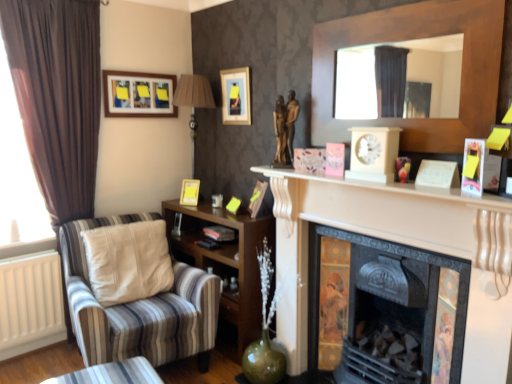
Describe the element at coordinates (139, 308) in the screenshot. I see `striped fabric armchair at left` at that location.

Measure the distance between metallic ornate fireplace at center, which is counted as the 2th fireplace, starting from the left, and camera.

metallic ornate fireplace at center, which is counted as the 2th fireplace, starting from the left, and camera are 1.64 meters apart from each other.

This screenshot has height=384, width=512. Identify the location of metallic silver lamp at upper center. (193, 101).

Describe the element at coordinates (401, 243) in the screenshot. Image resolution: width=512 pixels, height=384 pixels. I see `white glossy fireplace at center, placed as the first fireplace when sorted from left to right` at that location.

In order to face white glossy fireplace at center, placed as the second fireplace when sorted from right to left, should I rotate leftwards or rightwards?

It's best to rotate right around 14.042 degrees.

In order to face matte gold picture frame at center, which ranks as the 3th picture frame in top-to-bottom order, should I rotate leftwards or rightwards?

It's best to rotate left around 8.683 degrees.

Find the location of a particular element. The height and width of the screenshot is (384, 512). brown fabric curtain at left is located at coordinates (57, 96).

Consider the image. From the image's perspective, is bronze statue at center below brown fabric curtain at left?

No.

Is bronze statue at center closer to the viewer compared to brown fabric curtain at left?

Yes, bronze statue at center is closer to the viewer.

Locate an element on the screen. curtain lying below the bronze statue at center (from the image's perspective) is located at coordinates (57, 96).

Is point (296, 107) positioned before point (42, 126)?

Yes, it is.

Is matte gold picture frame at center, positioned as the 1th picture frame in bottom-to-top order, looking in the opposite direction of matte wooden picture frame at upper left, which ranks as the 3th picture frame in right-to-left order?

No, matte gold picture frame at center, positioned as the 1th picture frame in bottom-to-top order,'s orientation is not away from matte wooden picture frame at upper left, which ranks as the 3th picture frame in right-to-left order.

From the image's perspective, which one is positioned lower, matte gold picture frame at center, which ranks as the 3th picture frame in top-to-bottom order, or matte wooden picture frame at upper left, the 1th picture frame when ordered from top to bottom?

matte gold picture frame at center, which ranks as the 3th picture frame in top-to-bottom order, appears lower in the image.

How much distance is there between matte gold picture frame at center, arranged as the 2th picture frame when viewed from the right, and matte wooden picture frame at upper left, the 1th picture frame when ordered from top to bottom?

matte gold picture frame at center, arranged as the 2th picture frame when viewed from the right, is 27.25 inches from matte wooden picture frame at upper left, the 1th picture frame when ordered from top to bottom.

Identify the location of the 1st picture frame in front of the matte gold picture frame at center, arranged as the 2th picture frame when viewed from the right, counting from the anchor's position. (138, 94).

Is metallic ornate fireplace at center, which is counted as the 2th fireplace, starting from the left, not near metallic silver lamp at upper center?

metallic ornate fireplace at center, which is counted as the 2th fireplace, starting from the left, is positioned a significant distance from metallic silver lamp at upper center.

Which is more to the left, metallic ornate fireplace at center, the 1th fireplace viewed from the right, or metallic silver lamp at upper center?

metallic silver lamp at upper center is more to the left.

From a real-world perspective, does metallic ornate fireplace at center, the 1th fireplace viewed from the right, stand above metallic silver lamp at upper center?

No, from a real-world perspective, metallic ornate fireplace at center, the 1th fireplace viewed from the right, is not above metallic silver lamp at upper center.

Looking at this image, is the position of striped fabric armchair at left more distant than that of bronze statue at center?

No, striped fabric armchair at left is closer to the camera.

Find the location of a particular element. The width and height of the screenshot is (512, 384). sculpture above the striped fabric armchair at left (from the image's perspective) is located at coordinates (285, 127).

Can you confirm if striped fabric armchair at left is wider than bronze statue at center?

Yes, striped fabric armchair at left is wider than bronze statue at center.

How many degrees apart are the facing directions of striped fabric armchair at left and bronze statue at center?

There is a 45.2-degree angle between the facing directions of striped fabric armchair at left and bronze statue at center.

Which is behind, matte gold picture frame at center, positioned as the 1th picture frame in bottom-to-top order, or metallic ornate fireplace at center, which is counted as the 2th fireplace, starting from the left?

Positioned behind is matte gold picture frame at center, positioned as the 1th picture frame in bottom-to-top order.

Can you confirm if matte gold picture frame at center, the second picture frame viewed from the left, is positioned to the right of metallic ornate fireplace at center, the 1th fireplace viewed from the right?

In fact, matte gold picture frame at center, the second picture frame viewed from the left, is to the left of metallic ornate fireplace at center, the 1th fireplace viewed from the right.

From the image's perspective, is matte gold picture frame at center, the second picture frame viewed from the left, located above or below metallic ornate fireplace at center, which is counted as the 2th fireplace, starting from the left?

Clearly, from the image's perspective, matte gold picture frame at center, the second picture frame viewed from the left, is above metallic ornate fireplace at center, which is counted as the 2th fireplace, starting from the left.

Is matte gold picture frame at center, positioned as the 1th picture frame in bottom-to-top order, thinner than metallic ornate fireplace at center, which is counted as the 2th fireplace, starting from the left?

Yes.

Is matte gold picture frame at upper center, which is the 3th picture frame in left-to-right order, facing away from metallic ornate fireplace at center, the 1th fireplace viewed from the right?

matte gold picture frame at upper center, which is the 3th picture frame in left-to-right order, is not turned away from metallic ornate fireplace at center, the 1th fireplace viewed from the right.

Identify the location of picture frame that is the 1st object located behind the metallic ornate fireplace at center, which is counted as the 2th fireplace, starting from the left. The width and height of the screenshot is (512, 384). (236, 96).

From the image's perspective, is matte gold picture frame at upper center, which appears as the first picture frame when viewed from the right, above or below metallic ornate fireplace at center, which is counted as the 2th fireplace, starting from the left?

matte gold picture frame at upper center, which appears as the first picture frame when viewed from the right, is situated higher than metallic ornate fireplace at center, which is counted as the 2th fireplace, starting from the left, in the image.

What's the angular difference between matte gold picture frame at upper center, which is the 3th picture frame in left-to-right order, and metallic ornate fireplace at center, the 1th fireplace viewed from the right,'s facing directions?

The facing directions of matte gold picture frame at upper center, which is the 3th picture frame in left-to-right order, and metallic ornate fireplace at center, the 1th fireplace viewed from the right, are 2.95 degrees apart.

Is metallic ornate fireplace at center, which is counted as the 2th fireplace, starting from the left, looking in the opposite direction of wooden shelf at lower left?

No, metallic ornate fireplace at center, which is counted as the 2th fireplace, starting from the left,'s orientation is not away from wooden shelf at lower left.

Is metallic ornate fireplace at center, which is counted as the 2th fireplace, starting from the left, taller or shorter than wooden shelf at lower left?

Clearly, metallic ornate fireplace at center, which is counted as the 2th fireplace, starting from the left, is taller compared to wooden shelf at lower left.

How different are the orientations of metallic ornate fireplace at center, the 1th fireplace viewed from the right, and wooden shelf at lower left in degrees?

The facing directions of metallic ornate fireplace at center, the 1th fireplace viewed from the right, and wooden shelf at lower left are 3.26 degrees apart.

How much distance is there between metallic ornate fireplace at center, which is counted as the 2th fireplace, starting from the left, and wooden shelf at lower left?

A distance of 26.44 inches exists between metallic ornate fireplace at center, which is counted as the 2th fireplace, starting from the left, and wooden shelf at lower left.

Image resolution: width=512 pixels, height=384 pixels. I want to click on sculpture that is in front of the brown fabric curtain at left, so click(285, 127).

This screenshot has width=512, height=384. Find the location of `picture frame that is the 2nd object above the matte gold picture frame at center, positioned as the 1th picture frame in bottom-to-top order (from a real-world perspective)`. picture frame that is the 2nd object above the matte gold picture frame at center, positioned as the 1th picture frame in bottom-to-top order (from a real-world perspective) is located at coordinates (138, 94).

Based on their spatial positions, is metallic ornate fireplace at center, which is counted as the 2th fireplace, starting from the left, or metallic silver lamp at upper center closer to striped fabric armchair at left?

metallic ornate fireplace at center, which is counted as the 2th fireplace, starting from the left, is positioned closer to the anchor striped fabric armchair at left.

From the image, which object appears to be farther from metallic ornate fireplace at center, the 1th fireplace viewed from the right, matte gold picture frame at center, the second picture frame viewed from the left, or striped fabric armchair at left?

The object further to metallic ornate fireplace at center, the 1th fireplace viewed from the right, is matte gold picture frame at center, the second picture frame viewed from the left.

Based on the photo, based on their spatial positions, is brown fabric curtain at left or white glossy fireplace at center, placed as the first fireplace when sorted from left to right, further from striped fabric armchair at left?

white glossy fireplace at center, placed as the first fireplace when sorted from left to right, lies further to striped fabric armchair at left than the other object.

Looking at the image, which one is located further to metallic silver lamp at upper center, metallic ornate fireplace at center, the 1th fireplace viewed from the right, or matte gold picture frame at upper center, which is the 3th picture frame in left-to-right order?

Based on the image, metallic ornate fireplace at center, the 1th fireplace viewed from the right, appears to be further to metallic silver lamp at upper center.

Based on their spatial positions, is matte gold picture frame at upper center, acting as the second picture frame starting from the top, or brown fabric curtain at left closer to wooden shelf at lower left?

matte gold picture frame at upper center, acting as the second picture frame starting from the top, lies closer to wooden shelf at lower left than the other object.

Looking at this image, which object lies further to the anchor point matte gold picture frame at upper center, which is the 2th picture frame in bottom-to-top order, metallic ornate fireplace at center, which is counted as the 2th fireplace, starting from the left, or white glossy fireplace at center, placed as the first fireplace when sorted from left to right?

metallic ornate fireplace at center, which is counted as the 2th fireplace, starting from the left, lies further to matte gold picture frame at upper center, which is the 2th picture frame in bottom-to-top order, than the other object.

Looking at the image, which one is located closer to metallic ornate fireplace at center, the 1th fireplace viewed from the right, white glossy fireplace at center, placed as the first fireplace when sorted from left to right, or bronze statue at center?

white glossy fireplace at center, placed as the first fireplace when sorted from left to right, is closer to metallic ornate fireplace at center, the 1th fireplace viewed from the right.

Which object lies nearer to the anchor point matte wooden picture frame at upper left, the 1th picture frame in the left-to-right sequence, striped fabric armchair at left or brown fabric curtain at left?

brown fabric curtain at left lies closer to matte wooden picture frame at upper left, the 1th picture frame in the left-to-right sequence, than the other object.

Where is `chair located between matte wooden picture frame at upper left, the 1th picture frame in the left-to-right sequence, and white glossy fireplace at center, placed as the first fireplace when sorted from left to right, in the left-right direction`? The height and width of the screenshot is (384, 512). chair located between matte wooden picture frame at upper left, the 1th picture frame in the left-to-right sequence, and white glossy fireplace at center, placed as the first fireplace when sorted from left to right, in the left-right direction is located at coordinates (139, 308).

Identify the location of sculpture between striped fabric armchair at left and white glossy fireplace at center, placed as the first fireplace when sorted from left to right. This screenshot has width=512, height=384. (285, 127).

You are a GUI agent. You are given a task and a screenshot of the screen. Output one action in this format:
    pyautogui.click(x=<x>, y=<y>)
    Task: Click on the shelf positioned between white glossy fireplace at center, placed as the second fireplace when sorted from right to left, and matte wooden picture frame at upper left, the 1th picture frame in the left-to-right sequence, from near to far
    The height and width of the screenshot is (384, 512).
    Given the screenshot: What is the action you would take?
    pyautogui.click(x=226, y=259)

Locate an element on the screen. The height and width of the screenshot is (384, 512). shelf between matte wooden picture frame at upper left, which appears as the third picture frame when ordered from the bottom, and metallic ornate fireplace at center, which is counted as the 2th fireplace, starting from the left, in the vertical direction is located at coordinates (226, 259).